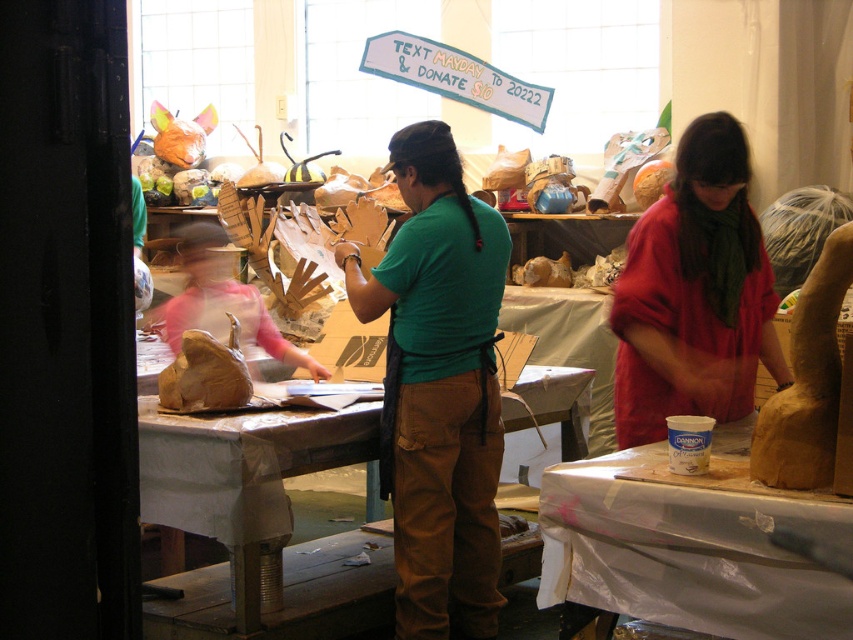
You are standing in the workshop and want to pick up an object. There are two points marked in the image, point (671,333) and point (280,348). Which point is closer to you?

Point (671,333) is closer to the camera than point (280,348).

You are an assistant in the workshop and need to locate the matte red shirt at center. According to the coordinates provided, where exactly is it positioned in the image?

The matte red shirt at center is located at point coordinates of 0.459 on the x axis and 0.815 on the y axis.

You are organizing a crafting session and need to place a new tool kit on the brown paper table at center. Based on the coordinates provided, where exactly should you position it?

The brown paper table at center is located at point (241, 476), so you should position the tool kit at those coordinates to ensure it is placed correctly on the table.